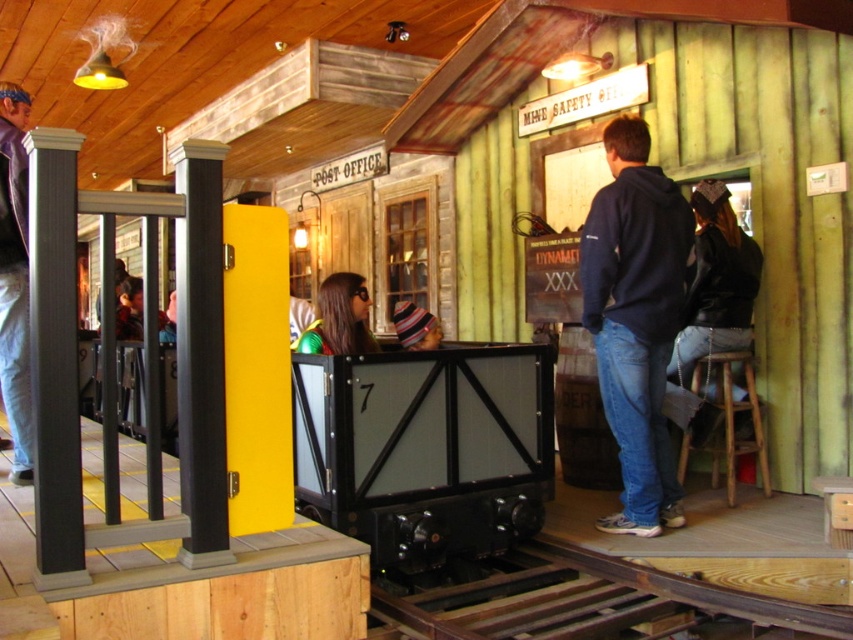
You are standing in the themed mining town and want to sit on the wooden stool at lower right. Is the navy blue hoodie at center blocking your path to it?

The navy blue hoodie at center is in front of the wooden stool at lower right, so it is blocking the path to the stool.